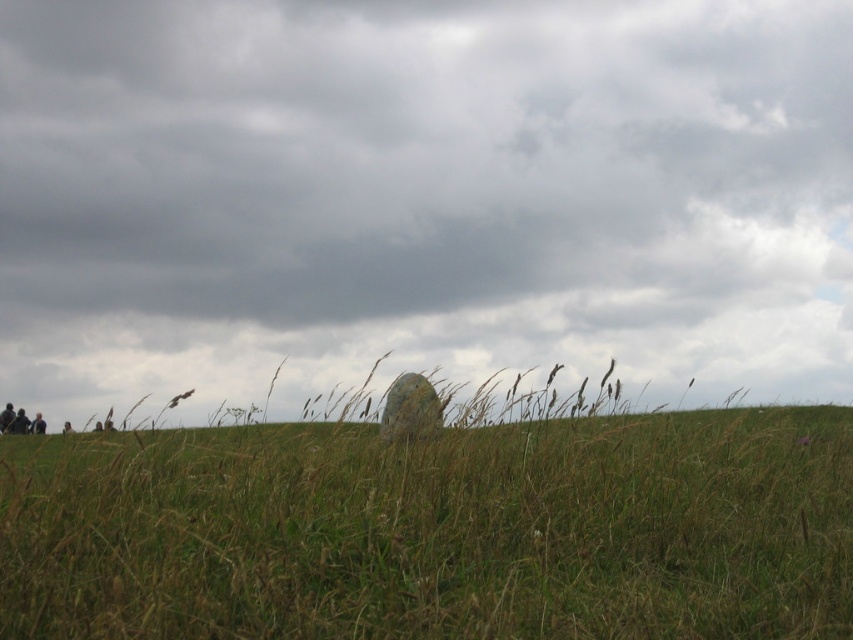
Is point (132, 400) more distant than point (538, 516)?

Yes.

Does gray cloudy sky at upper center have a smaller size compared to green grass at center?

Incorrect, gray cloudy sky at upper center is not smaller in size than green grass at center.

Who is more distant from viewer, (91,368) or (288,451)?

The point (91,368) is behind.

Where is `gray cloudy sky at upper center`? gray cloudy sky at upper center is located at coordinates (421, 195).